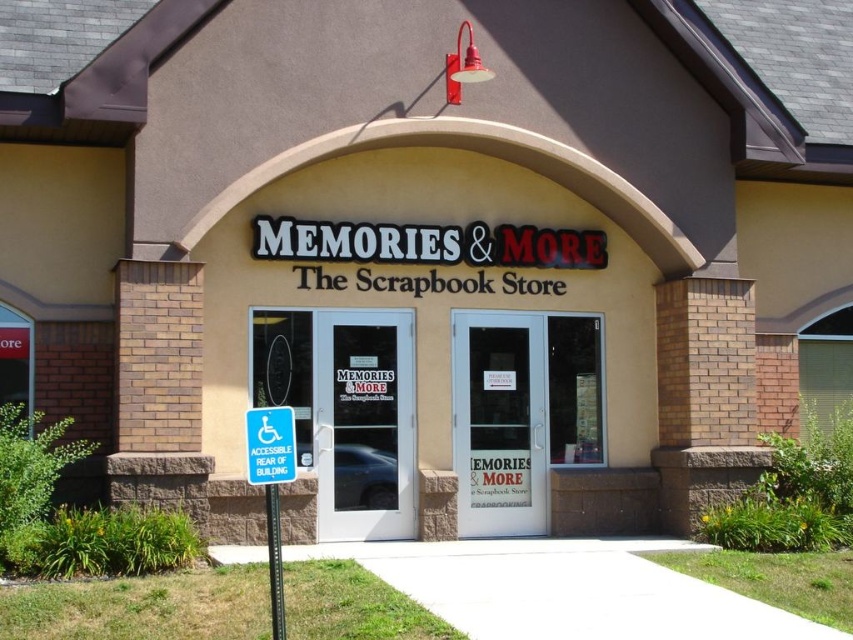
You are a customer standing in front of the store entrance. You want to read both the blue plastic sign at lower left and the blue plastic sign at center. Which sign should you look at first to avoid having one block your view of the other?

You should look at the blue plastic sign at lower left first because the blue plastic sign at center is behind it, so looking at the lower left one first will prevent the center sign from being blocked by the lower left one.

You are a customer approaching the entrance of Memories and More. You see the transparent glass door at center and the blue plastic sign at center. Which object is closer to the ground?

The transparent glass door at center is located below the blue plastic sign at center, so it is closer to the ground.

What is the spatial relationship between the transparent glass door at center and the blue plastic sign at lower left in the storefront of

The transparent glass door at center is located above the blue plastic sign at lower left.